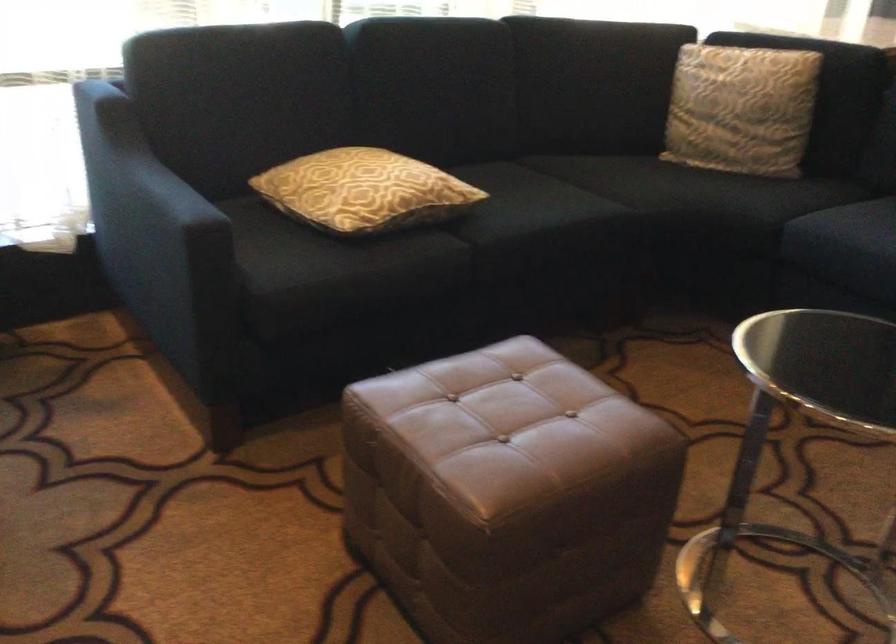
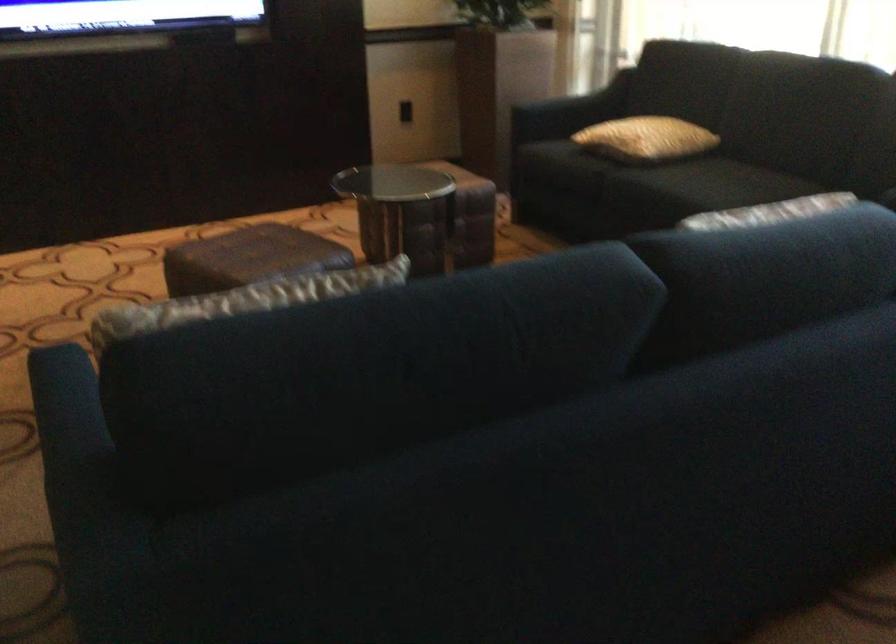
In the second image, find the point that corresponds to (x=159, y=187) in the first image.

(586, 99)